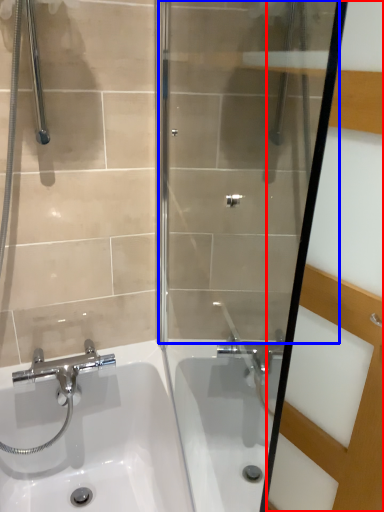
Question: Among these objects, which one is farthest to the camera, screen door (highlighted by a red box) or shower door (highlighted by a blue box)?

Choices:
 (A) screen door
 (B) shower door

Answer: (A)